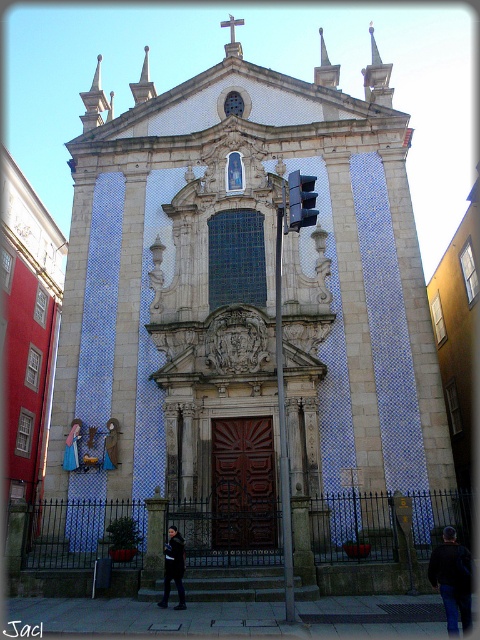
In the scene shown: You are a tailor observing a mannequin in a shop window. You see a black fabric jacket at lower center and a dark brown leather jacket at center. Which jacket is covering part of the other?

The black fabric jacket at lower center is positioned over the dark brown leather jacket at center, so it is covering part of it.

You are standing in front of the grand Portuguese Baroque church facade. You notice a black fabric jacket at lower center. Based on its position, where is the black fabric jacket located relative to the central arched window?

The black fabric jacket at lower center is located at point coordinates of (452, 580), which places it near the bottom central area of the image, below the central arched window.